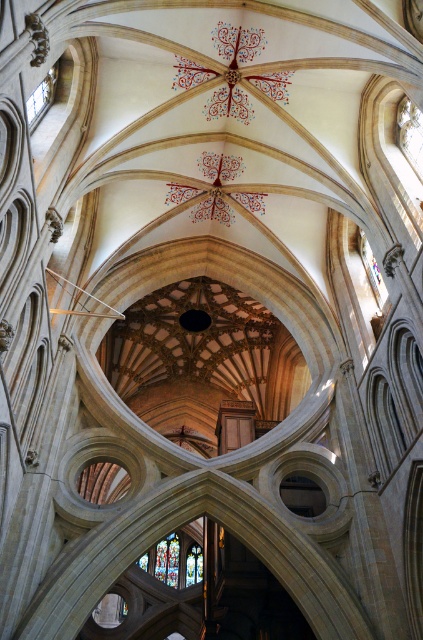
Question: Is stained glass at lower center above transparent glass window at upper left?

Choices:
 (A) yes
 (B) no

Answer: (B)

Question: Which object appears closest to the camera in this image?

Choices:
 (A) stained glass at lower center
 (B) transparent stained glass at upper right

Answer: (A)

Question: Is stained glass at lower center to the left of transparent stained glass at upper right from the viewer's perspective?

Choices:
 (A) yes
 (B) no

Answer: (A)

Question: Is the position of transparent stained glass at upper right less distant than that of transparent glass window at upper left?

Choices:
 (A) no
 (B) yes

Answer: (A)

Question: Among these points, which one is farthest from the camera?

Choices:
 (A) (167, 579)
 (B) (412, 108)
 (C) (27, 106)

Answer: (A)

Question: Which object appears farthest from the camera in this image?

Choices:
 (A) transparent stained glass at upper right
 (B) transparent glass window at upper left

Answer: (A)